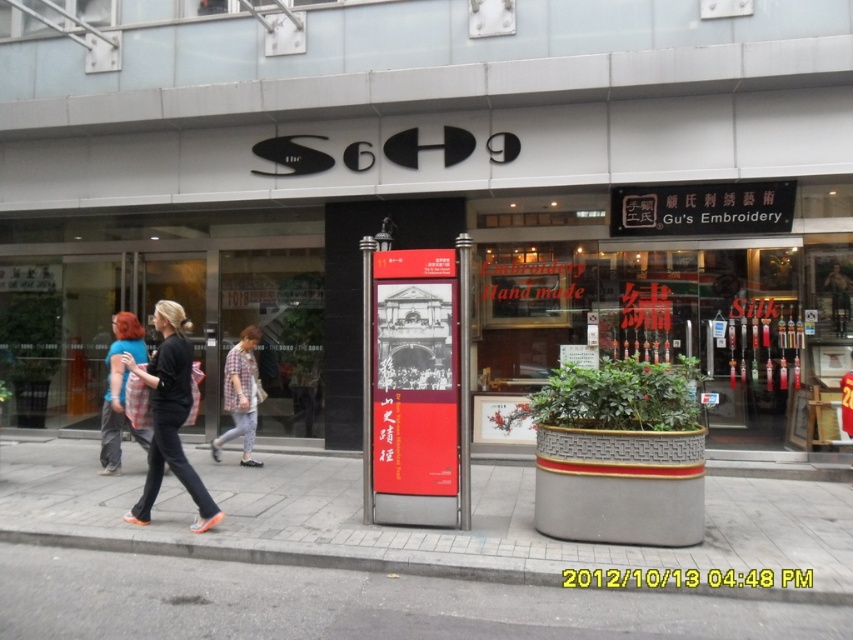
You are a customer looking at the plaid fabric shirt at left and the plaid fabric shirt at center in the storefront window. Which shirt is positioned farther to the left?

The plaid fabric shirt at left is positioned farther to the left than the plaid fabric shirt at center.